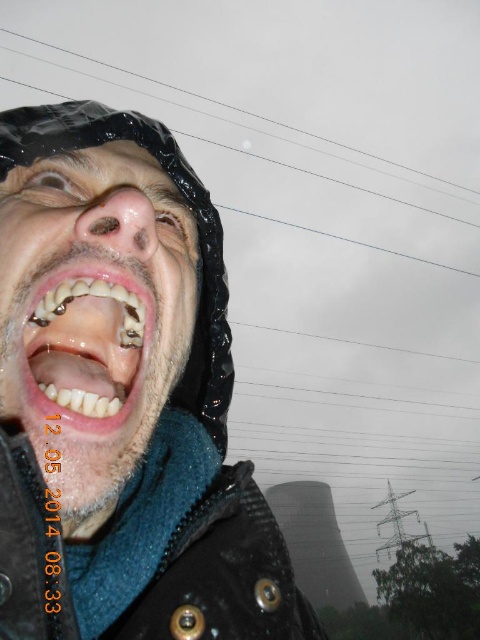
You are a photographer reviewing this image. You need to determine if the width of the shiny metallic face at center is wider than the white glossy teeth at center. Based on the scene, can you confirm this?

The shiny metallic face at center is wider than the white glossy teeth at center according to the description.

From the picture: You are a photographer standing in the rain and want to capture a clear photo of the shiny metallic face at center. Considering the distance between you and the object, what is the minimum focal length lens you should use to ensure the entire object fits in the frame?

The minimum focal length required depends on the sensor size of your camera and the desired field of view. However, since the distance is 20.08 inches, a macro lens with a focal length around 50mm to 100mm would typically be suitable for close focusing while maintaining sharpness and avoiding distortion.

You are a drone operator trying to navigate between two points in the image. The first point is point [169,314] and the second is point [111,432]. Which point is closer to your drone?

Point [169,314] is further to the viewer than point [111,432], so the second point is closer to the drone.